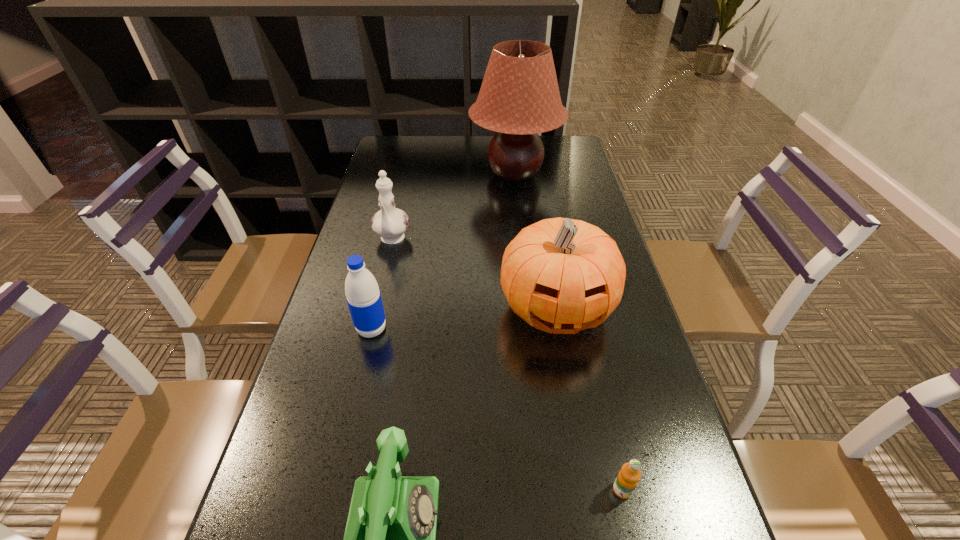
This screenshot has height=540, width=960. I want to click on object that ranks as the fifth closest to the second tallest object, so click(x=519, y=97).

I want to click on object identified as the fifth closest to the fifth tallest object, so click(519, 97).

Identify the location of vacant space that satisfies the following two spatial constraints: 1. on the front-facing side of the tallest object; 2. at the spout of the chinaware. The height and width of the screenshot is (540, 960). (522, 240).

This screenshot has height=540, width=960. I want to click on free space that satisfies the following two spatial constraints: 1. on the front-facing side of the tallest object; 2. at the spout of the chinaware, so click(x=522, y=240).

The image size is (960, 540). What are the coordinates of `free spot that satisfies the following two spatial constraints: 1. at the spout of the water bottle; 2. on the left side of the chinaware` in the screenshot? It's located at (372, 329).

This screenshot has height=540, width=960. I want to click on free space in the image that satisfies the following two spatial constraints: 1. on the front-facing side of the lampshade; 2. at the spout of the chinaware, so click(x=522, y=240).